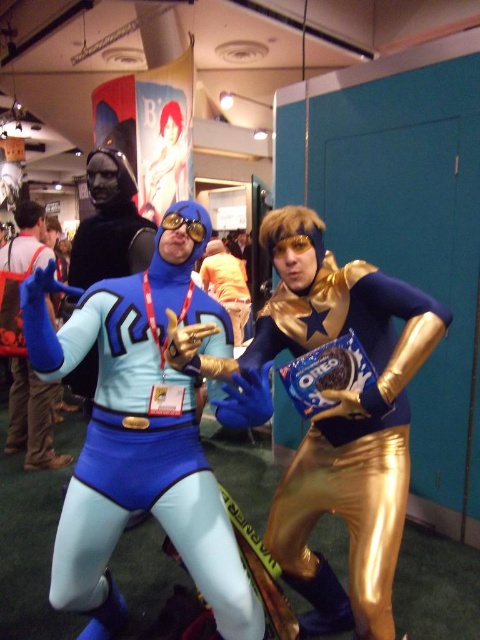
Question: Does matte blue spandex suit at center have a smaller size compared to gold metallic pants at center?

Choices:
 (A) no
 (B) yes

Answer: (A)

Question: Which point is farther to the camera?

Choices:
 (A) (50, 253)
 (B) (168, 440)
 (C) (266, 339)

Answer: (A)

Question: Considering the relative positions of gold metallic pants at center and matte blue suit at center in the image provided, where is gold metallic pants at center located with respect to matte blue suit at center?

Choices:
 (A) right
 (B) left

Answer: (A)

Question: Can you confirm if matte blue spandex suit at center is smaller than matte blue suit at center?

Choices:
 (A) yes
 (B) no

Answer: (A)

Question: Which of the following is the closest to the observer?

Choices:
 (A) (35, 211)
 (B) (404, 424)
 (C) (229, 604)

Answer: (C)

Question: Among these points, which one is farthest from the camera?

Choices:
 (A) (33, 378)
 (B) (379, 444)
 (C) (155, 380)

Answer: (A)